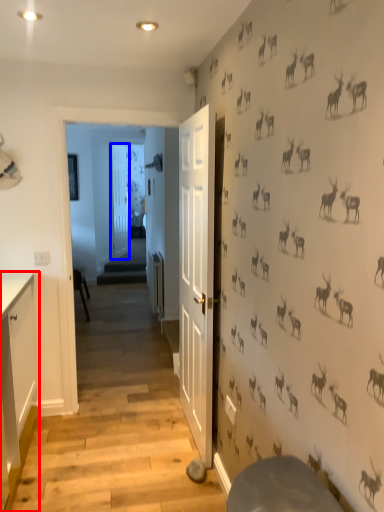
Question: Which object appears farthest to the camera in this image, cabinetry (highlighted by a red box) or door (highlighted by a blue box)?

Choices:
 (A) cabinetry
 (B) door

Answer: (B)